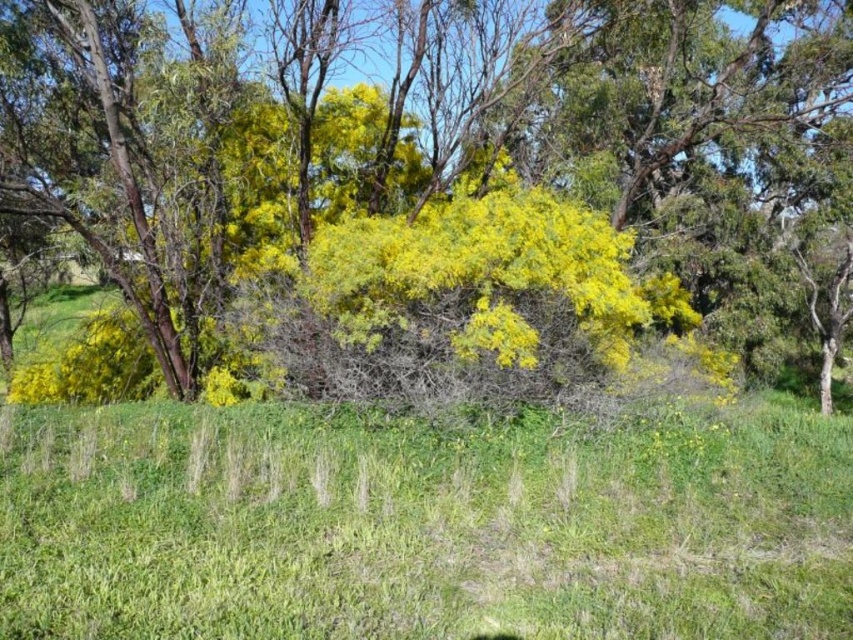
Question: Which object appears farthest from the camera in this image?

Choices:
 (A) yellow-green foliage at center
 (B) green grassy at center

Answer: (A)

Question: Is yellow-green foliage at center above green grassy at center?

Choices:
 (A) yes
 (B) no

Answer: (A)

Question: Does yellow-green foliage at center appear on the right side of green grassy at center?

Choices:
 (A) no
 (B) yes

Answer: (B)

Question: Which object appears closest to the camera in this image?

Choices:
 (A) yellow-green foliage at center
 (B) green grassy at center

Answer: (B)

Question: Does yellow-green foliage at center appear on the right side of green grassy at center?

Choices:
 (A) no
 (B) yes

Answer: (B)